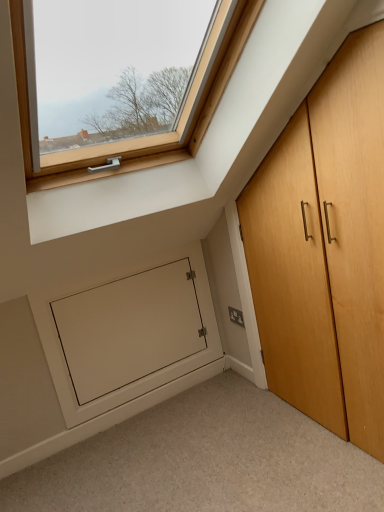
Question: Does light brown wood cupboard at right contain satin silver plate at lower right?

Choices:
 (A) no
 (B) yes

Answer: (A)

Question: Is light brown wood cupboard at right aimed at satin silver plate at lower right?

Choices:
 (A) yes
 (B) no

Answer: (B)

Question: From a real-world perspective, is light brown wood cupboard at right beneath satin silver plate at lower right?

Choices:
 (A) yes
 (B) no

Answer: (B)

Question: Does light brown wood cupboard at right have a greater height compared to satin silver plate at lower right?

Choices:
 (A) yes
 (B) no

Answer: (A)

Question: From a real-world perspective, does light brown wood cupboard at right stand above satin silver plate at lower right?

Choices:
 (A) no
 (B) yes

Answer: (B)

Question: From the image's perspective, is satin silver plate at lower right positioned above or below light brown wood cupboard at right?

Choices:
 (A) below
 (B) above

Answer: (A)

Question: Considering the relative positions of satin silver plate at lower right and light brown wood cupboard at right in the image provided, is satin silver plate at lower right to the left or to the right of light brown wood cupboard at right?

Choices:
 (A) right
 (B) left

Answer: (B)

Question: Does point (241, 322) appear closer or farther from the camera than point (347, 423)?

Choices:
 (A) farther
 (B) closer

Answer: (A)

Question: Choose the correct answer: Is satin silver plate at lower right inside light brown wood cupboard at right or outside it?

Choices:
 (A) outside
 (B) inside

Answer: (B)

Question: In the image, is white matte door at lower left on the left side or the right side of light brown wood cupboard at right?

Choices:
 (A) right
 (B) left

Answer: (B)

Question: In terms of size, does white matte door at lower left appear bigger or smaller than light brown wood cupboard at right?

Choices:
 (A) big
 (B) small

Answer: (B)

Question: Is white matte door at lower left inside the boundaries of light brown wood cupboard at right, or outside?

Choices:
 (A) inside
 (B) outside

Answer: (B)

Question: Does point (86, 394) appear closer or farther from the camera than point (276, 186)?

Choices:
 (A) closer
 (B) farther

Answer: (B)

Question: Relative to white matte door at lower left, is white matte door at lower left in front or behind?

Choices:
 (A) behind
 (B) front

Answer: (A)

Question: Considering the positions of white matte door at lower left and white matte door at lower left in the image, is white matte door at lower left wider or thinner than white matte door at lower left?

Choices:
 (A) thin
 (B) wide

Answer: (A)